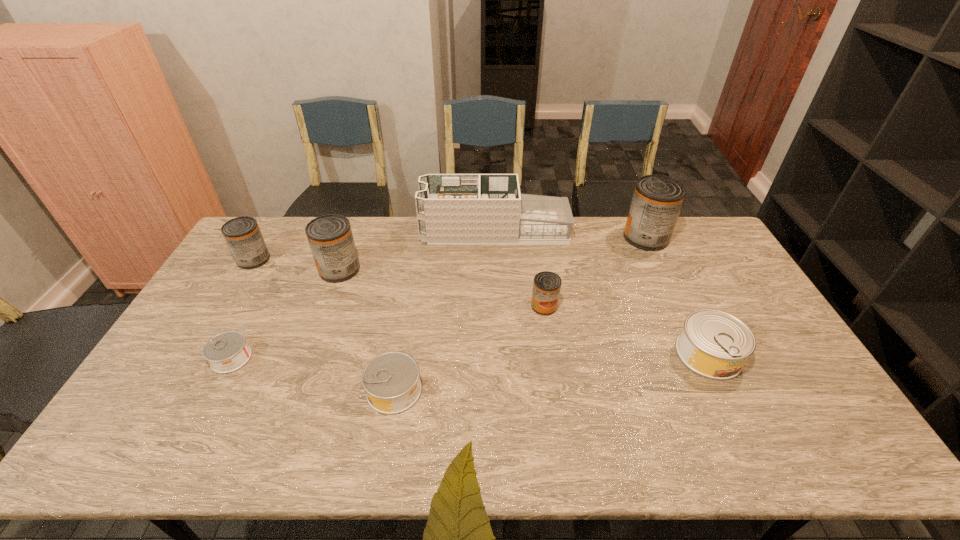
This screenshot has height=540, width=960. Find the location of `vacant space at the right edge of the desktop`. vacant space at the right edge of the desktop is located at coordinates (706, 269).

Find the location of a particular element. free space at the near left corner of the desktop is located at coordinates (130, 459).

Find the location of a particular element. vacant space at the far right corner of the desktop is located at coordinates (687, 225).

Identify the location of blank region between the smallest red can and the dollhouse. tap(519, 268).

At what (x,y) coordinates should I click in order to perform the action: click on free space that is in between the rightmost silver can and the dollhouse. Please return your answer as a coordinate pair (x, y). This screenshot has width=960, height=540. Looking at the image, I should click on (602, 292).

Locate an element on the screen. vacant space in between the fourth can from right to left and the third can from left to right is located at coordinates (367, 330).

In order to click on free space that is in between the second smallest silver can and the rightmost red can in this screenshot , I will do `click(520, 314)`.

Where is `vacant space that is in between the second biggest silver can and the smallest silver can`? vacant space that is in between the second biggest silver can and the smallest silver can is located at coordinates (313, 374).

At what (x,y) coordinates should I click in order to perform the action: click on empty space between the fifth shortest object and the dollhouse. Please return your answer as a coordinate pair (x, y). Looking at the image, I should click on (374, 245).

You are a GUI agent. You are given a task and a screenshot of the screen. Output one action in this format:
    pyautogui.click(x=<x>, y=<y>)
    Task: Click on the vacant region between the sixth shortest can and the biggest silver can
    The image size is (960, 540).
    Given the screenshot: What is the action you would take?
    pyautogui.click(x=524, y=312)